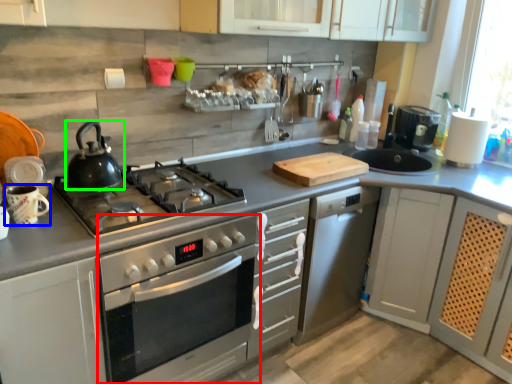
Question: Based on their relative distances, which object is nearer to oven (highlighted by a red box)? Choose from appliance (highlighted by a blue box) and kitchen appliance (highlighted by a green box).

Choices:
 (A) appliance
 (B) kitchen appliance

Answer: (B)